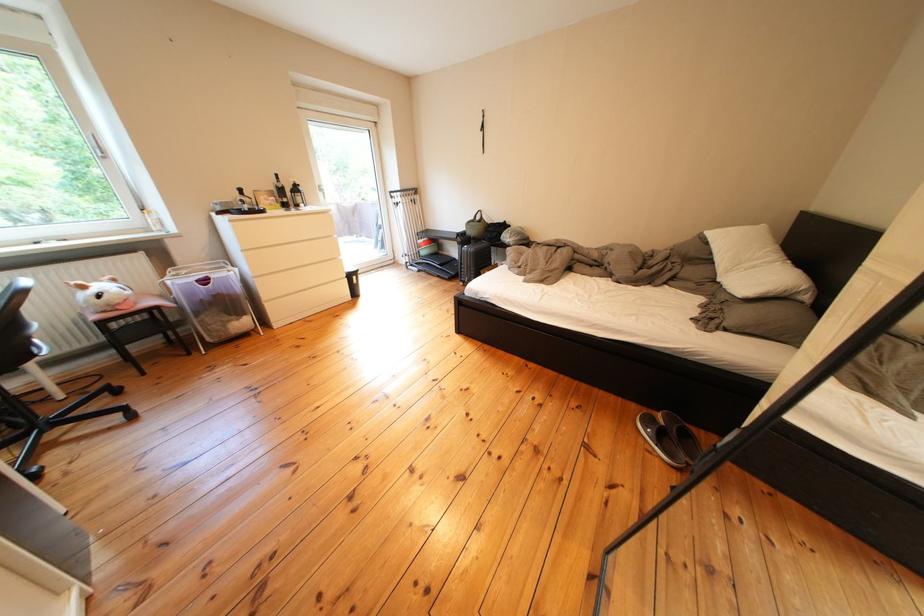
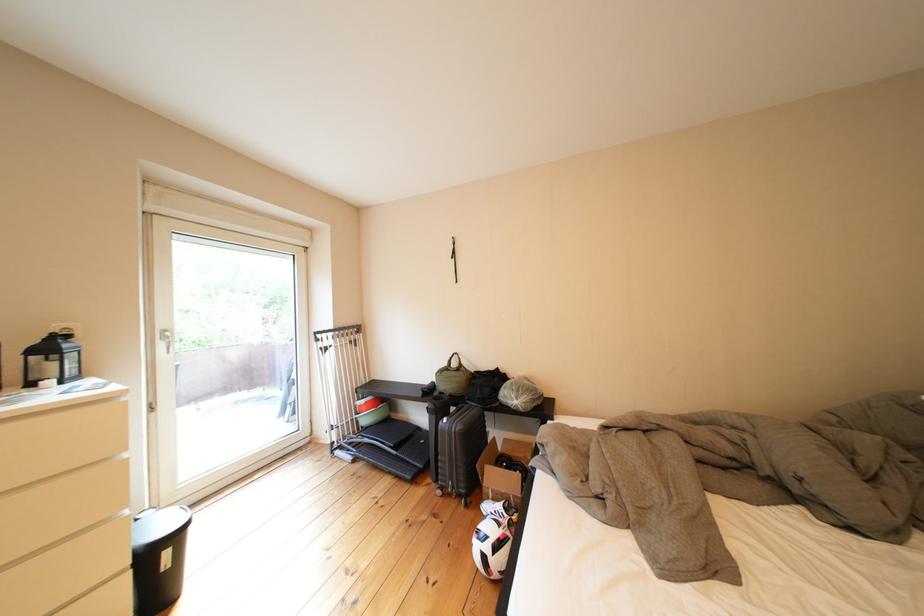
Where in the second image is the point corresponding to [369,282] from the first image?

(179, 557)